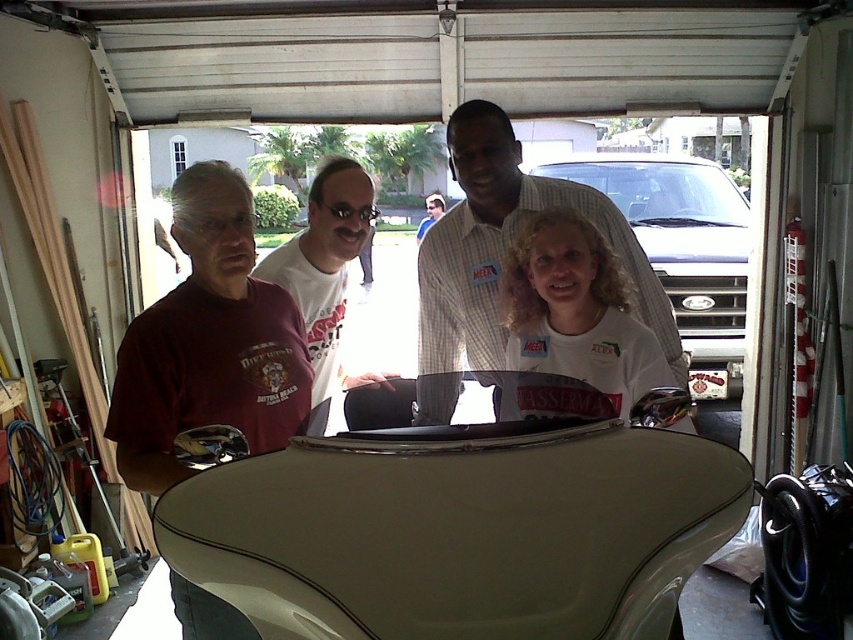
You are a photographer trying to capture a photo of the light beige leather convertible at center and the white matte shirt at center. Which object should you focus on first if you want to ensure both are in focus without adjusting the camera settings?

The light beige leather convertible at center is not as tall as the white matte shirt at center, so you should focus on the taller object first to ensure depth of field covers both.